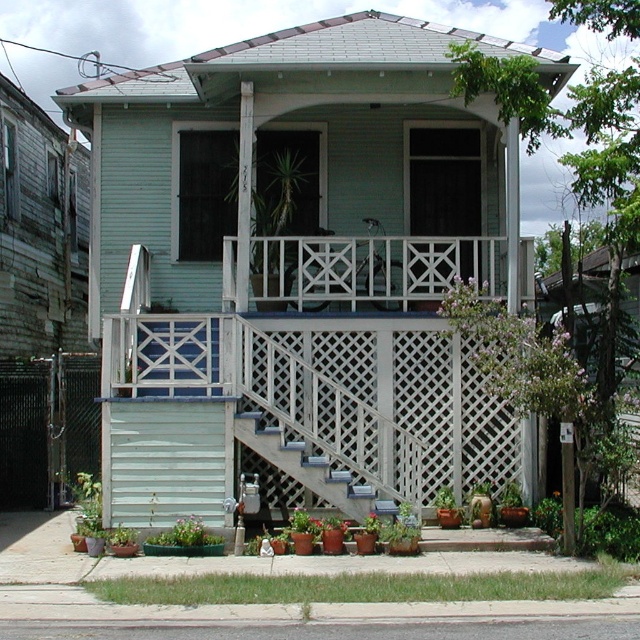
You are standing on the front lawn looking at the house. You see the green leafy grass at lower center and the green matte plant at lower center. Which one is positioned more to the right side?

The green leafy grass at lower center is positioned more to the right side than the green matte plant at lower center.

You are a delivery person trying to place a large package on the porch. The wooden stairs at center and the green matte plant at lower center are in the way. Which object should you move to make more space?

The wooden stairs at center has a greater width than the green matte plant at lower center, so you should move the wooden stairs at center to create more space.